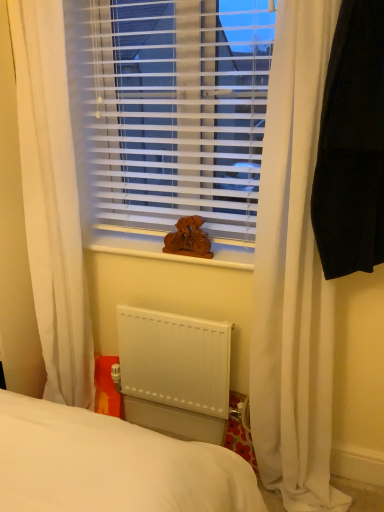
The width and height of the screenshot is (384, 512). Find the location of `free point above wooden statue at center (from a real-world perspective)`. free point above wooden statue at center (from a real-world perspective) is located at coordinates (151, 243).